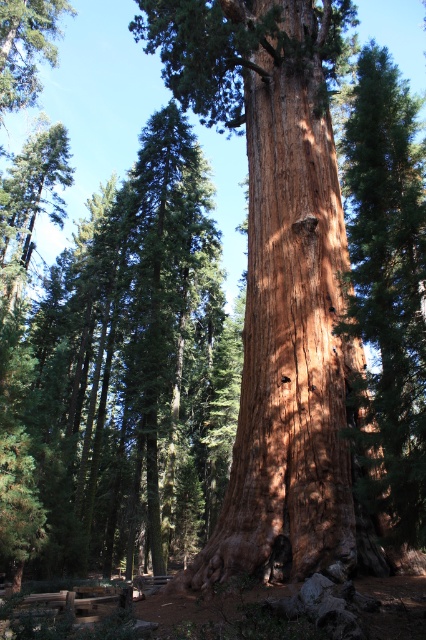
Question: Which point is closer to the camera?

Choices:
 (A) brown rough bark tree at center
 (B) green matte tree at upper left
 (C) smooth reddish-brown trunk at center

Answer: (A)

Question: Does smooth reddish-brown trunk at center have a greater width compared to brown rough bark tree at center?

Choices:
 (A) no
 (B) yes

Answer: (B)

Question: Based on their relative distances, which object is nearer to the green matte tree at upper left?

Choices:
 (A) brown rough bark tree at center
 (B) smooth reddish-brown trunk at center

Answer: (B)

Question: Does brown rough bark tree at center have a smaller size compared to green matte tree at upper left?

Choices:
 (A) yes
 (B) no

Answer: (B)

Question: Does brown rough bark tree at center have a lesser width compared to green matte tree at upper left?

Choices:
 (A) no
 (B) yes

Answer: (B)

Question: Which object is farther from the camera taking this photo?

Choices:
 (A) smooth reddish-brown trunk at center
 (B) green matte tree at upper left
 (C) brown rough bark tree at center

Answer: (B)